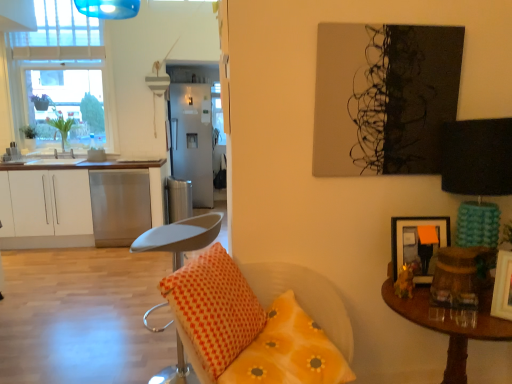
Question: From the image's perspective, is orange dotted pillow at lower center, which is the second pillow from left to right, above or below brown wooden table at right?

Choices:
 (A) below
 (B) above

Answer: (B)

Question: From their relative heights in the image, would you say orange dotted pillow at lower center, which is the second pillow from left to right, is taller or shorter than brown wooden table at right?

Choices:
 (A) short
 (B) tall

Answer: (A)

Question: Estimate the real-world distances between objects in this image. Which object is farther from the white matte cabinet at left?

Choices:
 (A) teal fabric lampshade at right
 (B) clear glass window at upper left
 (C) orange matte picture frame at upper right, which appears as the first picture frame when viewed from the back
 (D) orange dotted pillow at lower center, which is the second pillow from left to right
 (E) green leafy plant at left, which ranks as the 1th houseplant in left-to-right order

Answer: (A)

Question: Which object is the farthest from the satin silver trash can at center?

Choices:
 (A) wooden picture frame at right, the 1th picture frame viewed from the front
 (B) green leafy plant at left, the first houseplant from the right
 (C) clear glass window at upper left
 (D) satin silver refrigerator at center
 (E) teal fabric lampshade at right

Answer: (A)